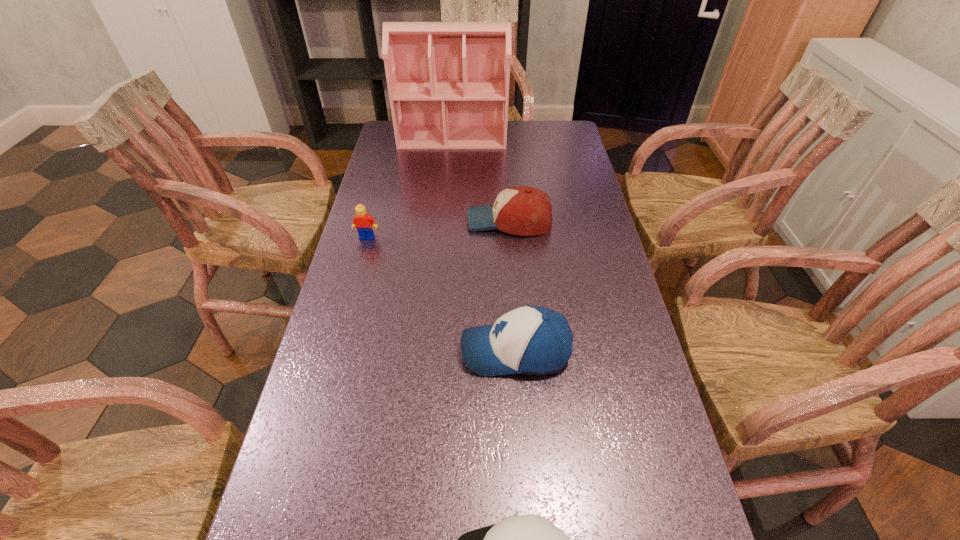
This screenshot has width=960, height=540. What are the coordinates of `free space in the image that satisfies the following two spatial constraints: 1. on the front-facing side of the farthest baseball cap; 2. on the face of the Lego` in the screenshot? It's located at (511, 237).